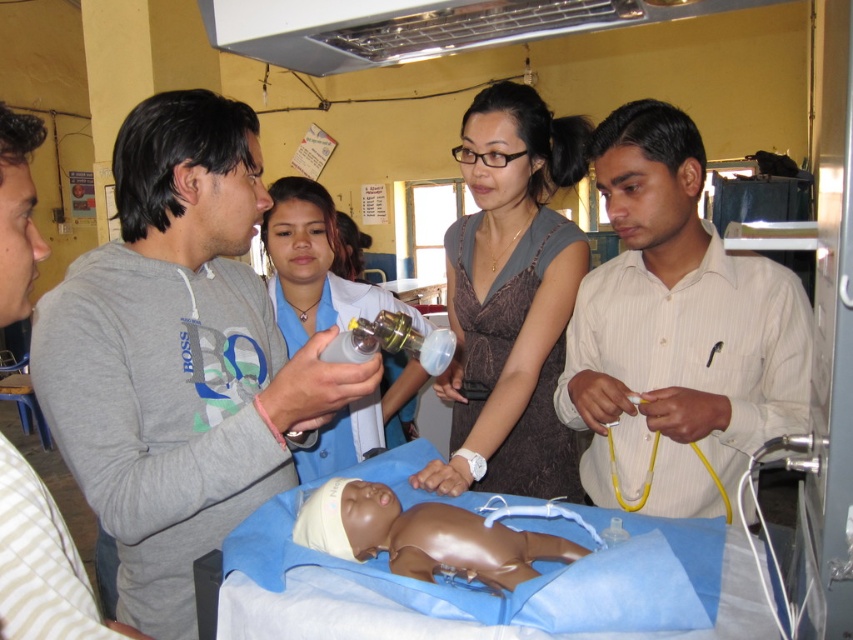
Question: Is the position of matte gray dress at center less distant than that of smooth plastic baby at center?

Choices:
 (A) yes
 (B) no

Answer: (B)

Question: Which is nearer to the matte blue uniform at center?

Choices:
 (A) smooth plastic baby at center
 (B) gray cotton shirt at left

Answer: (A)

Question: Estimate the real-world distances between objects in this image. Which object is closer to the smooth plastic baby at center?

Choices:
 (A) gray cotton shirt at left
 (B) white striped shirt at center
 (C) gray cotton sweatshirt at center

Answer: (C)

Question: Can you confirm if gray cotton shirt at left is positioned to the right of matte blue uniform at center?

Choices:
 (A) no
 (B) yes

Answer: (A)

Question: Estimate the real-world distances between objects in this image. Which object is closer to the smooth plastic baby at center?

Choices:
 (A) gray cotton sweatshirt at center
 (B) matte gray dress at center

Answer: (A)

Question: Is gray cotton sweatshirt at center bigger than gray cotton shirt at left?

Choices:
 (A) no
 (B) yes

Answer: (B)